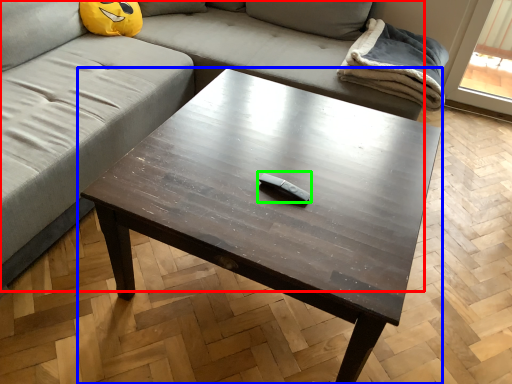
Question: Which object is positioned farthest from studio couch (highlighted by a red box)? Select from coffee table (highlighted by a blue box) and Wii controller (highlighted by a green box).

Choices:
 (A) coffee table
 (B) Wii controller

Answer: (B)